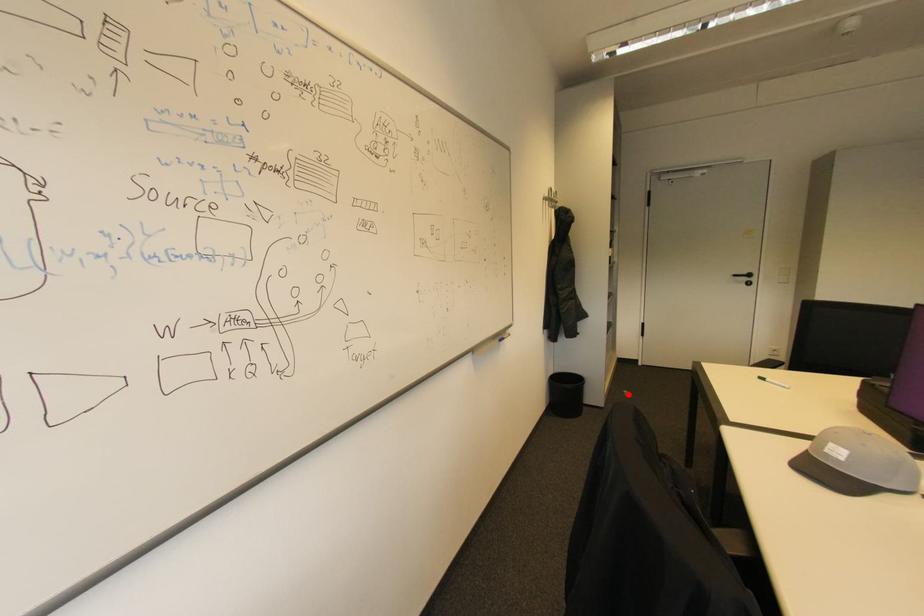
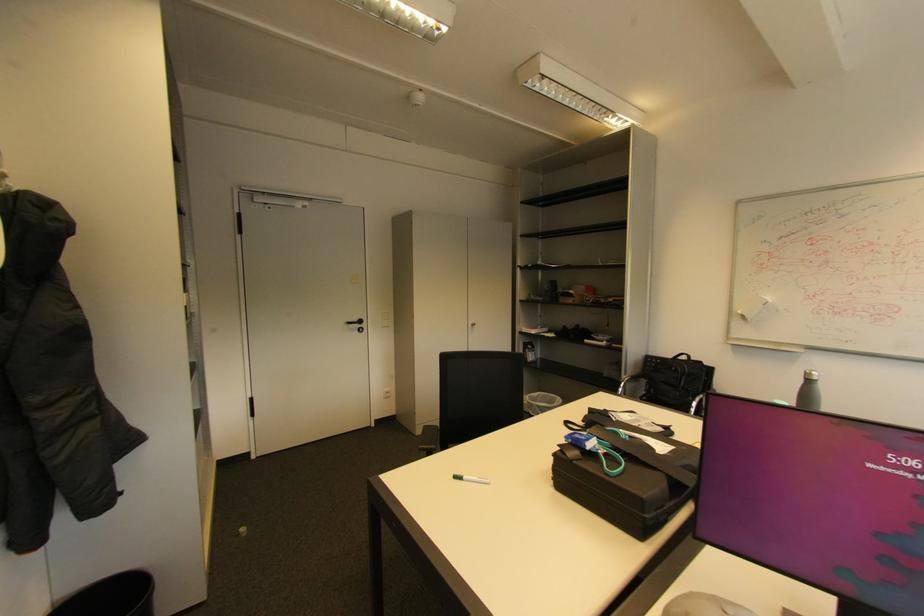
Find the pixel in the second image that matches the highlighted location in the first image.

(244, 535)